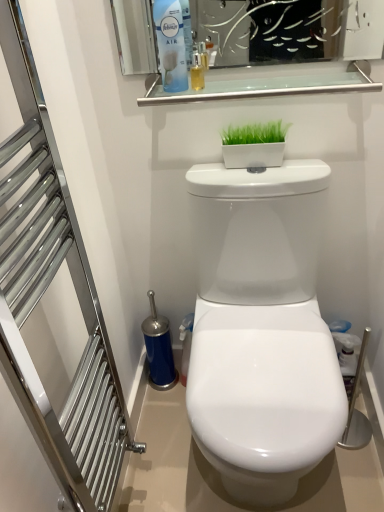
What do you see at coordinates (171, 44) in the screenshot? I see `blue plastic air freshener at upper center` at bounding box center [171, 44].

In the scene shown: In order to face white glossy rectangular planter at upper center, should I rotate leftwards or rightwards?

Rotate your view right by about 8.418°.

Describe the element at coordinates (267, 87) in the screenshot. I see `clear glass shelf at upper center` at that location.

At what (x,y) coordinates should I click in order to perform the action: click on brushed metal towel rack at left. Please return your answer as a coordinate pair (x, y). Looking at the image, I should click on (45, 291).

Could you tell me if clear glass shelf at upper center is turned towards blue plastic air freshener at upper center?

No, clear glass shelf at upper center is not turned towards blue plastic air freshener at upper center.

Which object is positioned more to the right, clear glass shelf at upper center or blue plastic air freshener at upper center?

From the viewer's perspective, clear glass shelf at upper center appears more on the right side.

From a real-world perspective, between clear glass shelf at upper center and blue plastic air freshener at upper center, who is vertically higher?

blue plastic air freshener at upper center.

Does clear glass shelf at upper center have a greater width compared to blue plastic air freshener at upper center?

Yes.

Find the location of a particular element. This screenshot has height=512, width=384. screen door that is on the left side of white glossy rectangular planter at upper center is located at coordinates (45, 291).

Considering the relative sizes of brushed metal towel rack at left and white glossy rectangular planter at upper center in the image provided, is brushed metal towel rack at left shorter than white glossy rectangular planter at upper center?

No, brushed metal towel rack at left is not shorter than white glossy rectangular planter at upper center.

From the image's perspective, between brushed metal towel rack at left and white glossy rectangular planter at upper center, who is located below?

brushed metal towel rack at left appears lower in the image.

Considering the positions of points (117, 402) and (247, 130), is point (117, 402) farther from camera compared to point (247, 130)?

That is True.

Is brushed metal towel rack at left with blue plastic air freshener at upper center?

brushed metal towel rack at left and blue plastic air freshener at upper center are not in contact.

From a real-world perspective, is brushed metal towel rack at left positioned over blue plastic air freshener at upper center based on gravity?

No, from a real-world perspective, brushed metal towel rack at left is not above blue plastic air freshener at upper center.

From the picture: From the image's perspective, is brushed metal towel rack at left above blue plastic air freshener at upper center?

No, from the image's perspective, brushed metal towel rack at left is not on top of blue plastic air freshener at upper center.

Can you confirm if brushed metal towel rack at left is positioned to the right of blue plastic air freshener at upper center?

No, brushed metal towel rack at left is not to the right of blue plastic air freshener at upper center.

Are blue plastic air freshener at upper center and white glossy rectangular planter at upper center making contact?

No, blue plastic air freshener at upper center is not making contact with white glossy rectangular planter at upper center.

Measure the distance between blue plastic air freshener at upper center and white glossy rectangular planter at upper center.

blue plastic air freshener at upper center is 9.63 inches from white glossy rectangular planter at upper center.

Considering the relative sizes of blue plastic air freshener at upper center and white glossy rectangular planter at upper center in the image provided, is blue plastic air freshener at upper center wider than white glossy rectangular planter at upper center?

Correct, the width of blue plastic air freshener at upper center exceeds that of white glossy rectangular planter at upper center.

Which object is positioned more to the left, blue plastic air freshener at upper center or white glossy rectangular planter at upper center?

blue plastic air freshener at upper center is more to the left.

Looking at this image, are clear glass shelf at upper center and white glossy rectangular planter at upper center making contact?

clear glass shelf at upper center and white glossy rectangular planter at upper center are not in contact.

Which object is positioned more to the left, clear glass shelf at upper center or white glossy rectangular planter at upper center?

clear glass shelf at upper center is more to the left.

How many degrees apart are the facing directions of clear glass shelf at upper center and white glossy rectangular planter at upper center?

The angle between the facing direction of clear glass shelf at upper center and the facing direction of white glossy rectangular planter at upper center is 0.0159 degrees.

Between clear glass shelf at upper center and white glossy rectangular planter at upper center, which one has larger size?

clear glass shelf at upper center is bigger.

From the image's perspective, relative to brushed metal towel rack at left, is blue plastic air freshener at upper center above or below?

blue plastic air freshener at upper center is situated higher than brushed metal towel rack at left in the image.

From a real-world perspective, is blue plastic air freshener at upper center positioned under brushed metal towel rack at left based on gravity?

No, from a real-world perspective, blue plastic air freshener at upper center is not beneath brushed metal towel rack at left.

Could you tell me if blue plastic air freshener at upper center is facing brushed metal towel rack at left?

No, blue plastic air freshener at upper center is not aimed at brushed metal towel rack at left.

Considering the relative sizes of clear glass shelf at upper center and brushed metal towel rack at left in the image provided, is clear glass shelf at upper center smaller than brushed metal towel rack at left?

Yes, clear glass shelf at upper center is smaller than brushed metal towel rack at left.

What's the angular difference between clear glass shelf at upper center and brushed metal towel rack at left's facing directions?

The facing directions of clear glass shelf at upper center and brushed metal towel rack at left are 88.2 degrees apart.

From the image's perspective, between clear glass shelf at upper center and brushed metal towel rack at left, which one is located above?

From the image's view, clear glass shelf at upper center is above.

Which object is closer to the camera taking this photo, clear glass shelf at upper center or brushed metal towel rack at left?

Positioned in front is brushed metal towel rack at left.

This screenshot has width=384, height=512. Find the location of `balustrade on the right of blue plastic air freshener at upper center`. balustrade on the right of blue plastic air freshener at upper center is located at coordinates (267, 87).

Where is `houseplant above the brushed metal towel rack at left (from the image's perspective)`? Image resolution: width=384 pixels, height=512 pixels. houseplant above the brushed metal towel rack at left (from the image's perspective) is located at coordinates (254, 145).

Considering their positions, is blue plastic air freshener at upper center positioned closer to brushed metal towel rack at left than clear glass shelf at upper center?

clear glass shelf at upper center lies closer to brushed metal towel rack at left than the other object.

Estimate the real-world distances between objects in this image. Which object is closer to clear glass shelf at upper center, white glossy rectangular planter at upper center or blue plastic air freshener at upper center?

white glossy rectangular planter at upper center lies closer to clear glass shelf at upper center than the other object.

When comparing their distances from blue plastic air freshener at upper center, does brushed metal towel rack at left or clear glass shelf at upper center seem closer?

clear glass shelf at upper center is positioned closer to the anchor blue plastic air freshener at upper center.

In the scene shown: Based on their spatial positions, is white glossy rectangular planter at upper center or brushed metal towel rack at left closer to blue plastic air freshener at upper center?

white glossy rectangular planter at upper center lies closer to blue plastic air freshener at upper center than the other object.

In the scene shown: From the image, which object appears to be farther from clear glass shelf at upper center, blue plastic air freshener at upper center or white glossy rectangular planter at upper center?

→ blue plastic air freshener at upper center.

Based on their spatial positions, is white glossy rectangular planter at upper center or brushed metal towel rack at left further from clear glass shelf at upper center?

brushed metal towel rack at left.

Which object lies further to the anchor point clear glass shelf at upper center, blue plastic air freshener at upper center or brushed metal towel rack at left?

brushed metal towel rack at left is further to clear glass shelf at upper center.

Estimate the real-world distances between objects in this image. Which object is further from brushed metal towel rack at left, clear glass shelf at upper center or white glossy rectangular planter at upper center?

white glossy rectangular planter at upper center.

Find the location of `balustrade between brushed metal towel rack at left and white glossy rectangular planter at upper center in the front-back direction`. balustrade between brushed metal towel rack at left and white glossy rectangular planter at upper center in the front-back direction is located at coordinates (267, 87).

Image resolution: width=384 pixels, height=512 pixels. I want to click on balustrade between blue plastic air freshener at upper center and brushed metal towel rack at left vertically, so click(x=267, y=87).

Where is `balustrade between blue plastic air freshener at upper center and white glossy rectangular planter at upper center in the front-back direction`? balustrade between blue plastic air freshener at upper center and white glossy rectangular planter at upper center in the front-back direction is located at coordinates pyautogui.click(x=267, y=87).

Identify the location of cleaning product between brushed metal towel rack at left and white glossy rectangular planter at upper center from front to back. (171, 44).